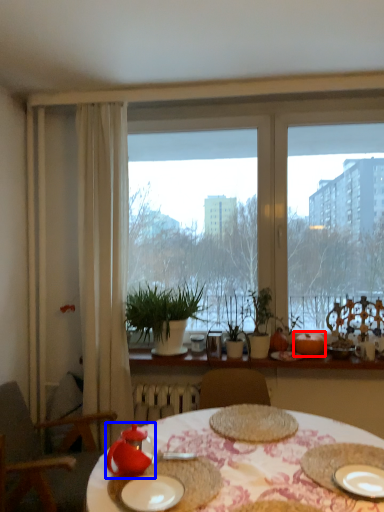
Question: Which of the following is the closest to the observer, fruit (highlighted by a red box) or tableware (highlighted by a blue box)?

Choices:
 (A) fruit
 (B) tableware

Answer: (B)